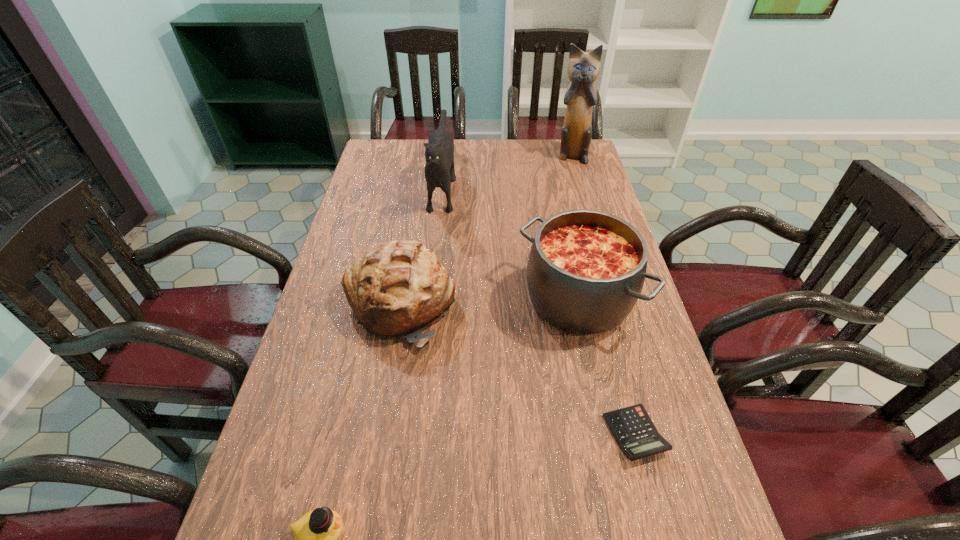
Where is `free space located on the back of the third tallest object`? This screenshot has width=960, height=540. free space located on the back of the third tallest object is located at coordinates (565, 239).

At what (x,y) coordinates should I click in order to perform the action: click on free spot located 0.160m on the back of the fourth tallest object. Please return your answer as a coordinate pair (x, y). This screenshot has width=960, height=540. Looking at the image, I should click on (414, 229).

Find the location of `vacant space located on the front of the second nearest object`. vacant space located on the front of the second nearest object is located at coordinates (653, 503).

Find the location of a particular element. object positioned at the left edge is located at coordinates (397, 288).

What are the coordinates of `cat at the right edge` in the screenshot? It's located at (583, 69).

Where is `casserole present at the right edge`? This screenshot has width=960, height=540. casserole present at the right edge is located at coordinates (586, 269).

At what (x,y) coordinates should I click in order to perform the action: click on calculator located at the right edge. Please return your answer as a coordinate pair (x, y). Looking at the image, I should click on (636, 435).

At what (x,y) coordinates should I click in order to perform the action: click on object at the far right corner. Please return your answer as a coordinate pair (x, y). Looking at the image, I should click on (583, 69).

The height and width of the screenshot is (540, 960). I want to click on free space at the far edge of the desktop, so click(455, 148).

Image resolution: width=960 pixels, height=540 pixels. I want to click on free space at the left edge of the desktop, so click(345, 302).